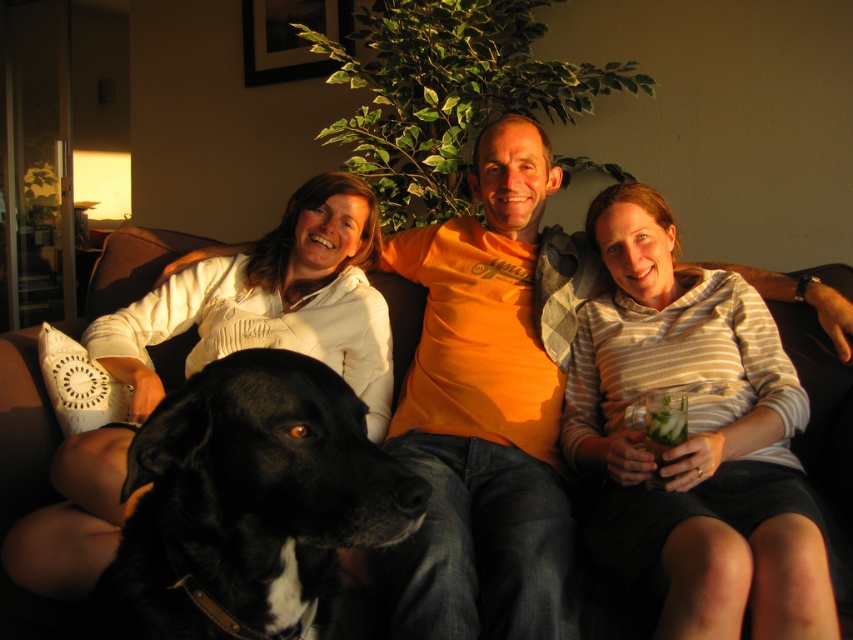
Is striped cotton shirt at center further to camera compared to white cotton shirt at center?

No, striped cotton shirt at center is closer to the viewer.

Is striped cotton shirt at center smaller than white cotton shirt at center?

Yes, striped cotton shirt at center is smaller than white cotton shirt at center.

At what (x,y) coordinates should I click in order to perform the action: click on striped cotton shirt at center. Please return your answer as a coordinate pair (x, y). This screenshot has height=640, width=853. Looking at the image, I should click on (694, 436).

Is point (296, 508) closer to viewer compared to point (370, 342)?

That is True.

Does black leather dog at lower left have a greater width compared to white cotton shirt at center?

No.

Image resolution: width=853 pixels, height=640 pixels. I want to click on black leather dog at lower left, so click(x=248, y=502).

Which is below, striped cotton shirt at center or black leather dog at lower left?

Positioned lower is black leather dog at lower left.

Which of these two, striped cotton shirt at center or black leather dog at lower left, stands shorter?

Standing shorter between the two is black leather dog at lower left.

You are a GUI agent. You are given a task and a screenshot of the screen. Output one action in this format:
    pyautogui.click(x=<x>, y=<y>)
    Task: Click on the striped cotton shirt at center
    
    Given the screenshot: What is the action you would take?
    pyautogui.click(x=694, y=436)

The height and width of the screenshot is (640, 853). What are the coordinates of `striped cotton shirt at center` in the screenshot? It's located at (694, 436).